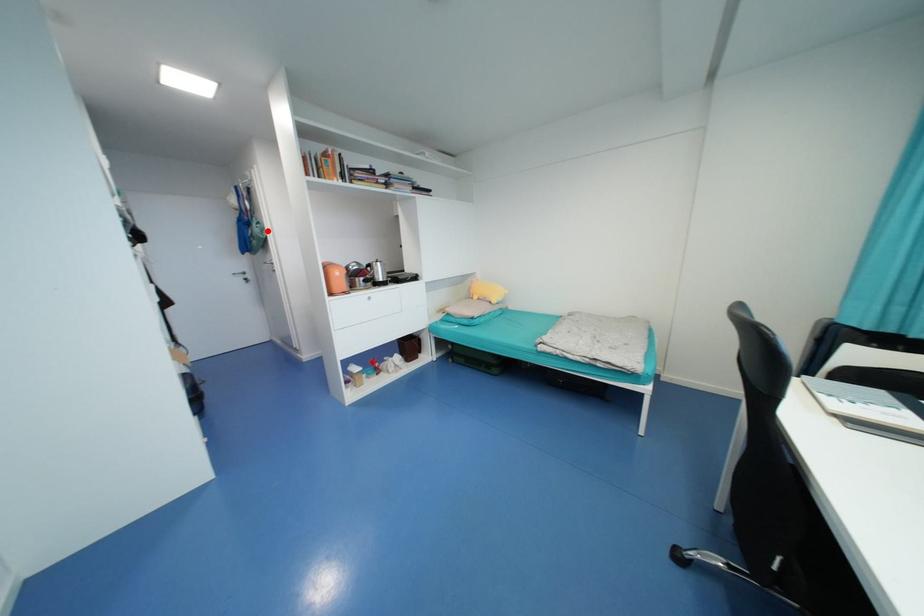
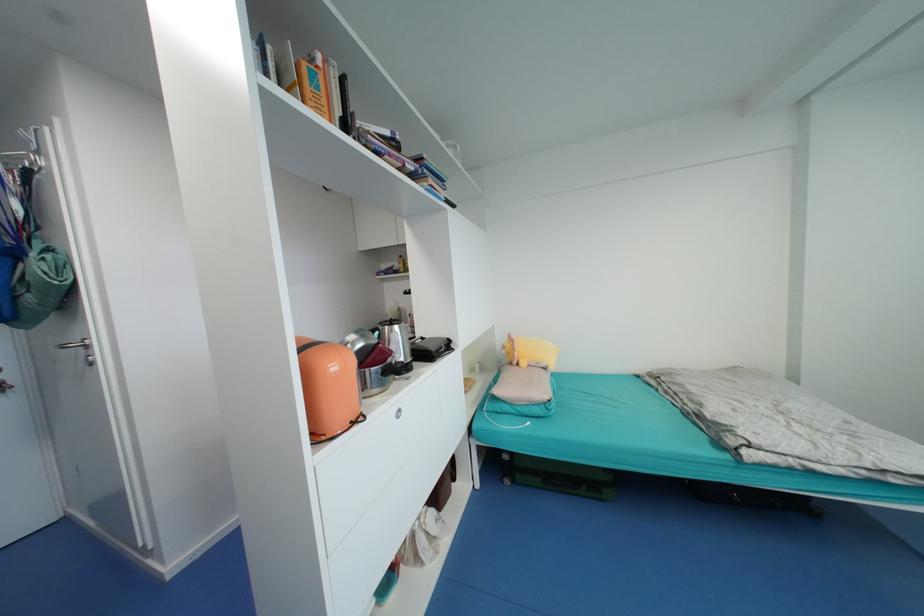
The point at the highlighted location is marked in the first image. Where is the corresponding point in the second image?

(68, 267)